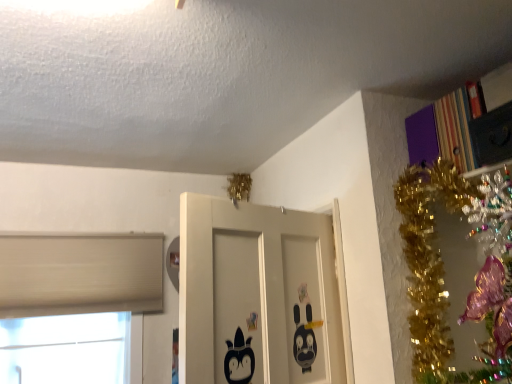
Question: Is black matte door at center positioned far away from striped cardboard bookcase at upper right?

Choices:
 (A) no
 (B) yes

Answer: (A)

Question: From the image's perspective, is black matte door at center under striped cardboard bookcase at upper right?

Choices:
 (A) yes
 (B) no

Answer: (A)

Question: Is black matte door at center further to the viewer compared to striped cardboard bookcase at upper right?

Choices:
 (A) yes
 (B) no

Answer: (B)

Question: Can you confirm if black matte door at center is bigger than striped cardboard bookcase at upper right?

Choices:
 (A) yes
 (B) no

Answer: (A)

Question: From a real-world perspective, is black matte door at center positioned under striped cardboard bookcase at upper right based on gravity?

Choices:
 (A) yes
 (B) no

Answer: (A)

Question: Would you say striped cardboard bookcase at upper right is inside or outside black matte door at center?

Choices:
 (A) inside
 (B) outside

Answer: (B)

Question: Considering their positions, is striped cardboard bookcase at upper right located in front of or behind black matte door at center?

Choices:
 (A) front
 (B) behind

Answer: (B)

Question: Looking at their shapes, would you say striped cardboard bookcase at upper right is wider or thinner than black matte door at center?

Choices:
 (A) wide
 (B) thin

Answer: (B)

Question: Considering the positions of striped cardboard bookcase at upper right and black matte door at center in the image, is striped cardboard bookcase at upper right taller or shorter than black matte door at center?

Choices:
 (A) tall
 (B) short

Answer: (B)

Question: Is striped cardboard bookcase at upper right bigger or smaller than white matte window at lower left?

Choices:
 (A) big
 (B) small

Answer: (B)

Question: In the image, is striped cardboard bookcase at upper right positioned in front of or behind white matte window at lower left?

Choices:
 (A) behind
 (B) front

Answer: (B)

Question: Looking at their shapes, would you say striped cardboard bookcase at upper right is wider or thinner than white matte window at lower left?

Choices:
 (A) thin
 (B) wide

Answer: (B)

Question: Is point (493, 97) closer or farther from the camera than point (6, 269)?

Choices:
 (A) closer
 (B) farther

Answer: (A)

Question: Considering the positions of black matte door at center and white matte window at lower left in the image, is black matte door at center bigger or smaller than white matte window at lower left?

Choices:
 (A) small
 (B) big

Answer: (B)

Question: Choose the correct answer: Is black matte door at center inside white matte window at lower left or outside it?

Choices:
 (A) inside
 (B) outside

Answer: (B)